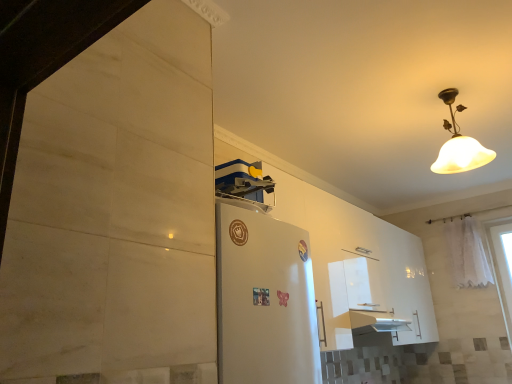
Question: Does white matte lampshade at upper right turn towards white sheer curtain at right?

Choices:
 (A) no
 (B) yes

Answer: (A)

Question: Is white matte lampshade at upper right positioned behind white sheer curtain at right?

Choices:
 (A) yes
 (B) no

Answer: (B)

Question: Considering the relative sizes of white matte lampshade at upper right and white sheer curtain at right in the image provided, is white matte lampshade at upper right smaller than white sheer curtain at right?

Choices:
 (A) yes
 (B) no

Answer: (B)

Question: Is white matte lampshade at upper right to the left of white sheer curtain at right from the viewer's perspective?

Choices:
 (A) yes
 (B) no

Answer: (A)

Question: From the image's perspective, is white matte lampshade at upper right above white sheer curtain at right?

Choices:
 (A) yes
 (B) no

Answer: (A)

Question: Can you confirm if white matte lampshade at upper right is bigger than white sheer curtain at right?

Choices:
 (A) no
 (B) yes

Answer: (B)

Question: Is white sheer curtain at right with white matte lampshade at upper right?

Choices:
 (A) no
 (B) yes

Answer: (A)

Question: From a real-world perspective, is white sheer curtain at right on white matte lampshade at upper right?

Choices:
 (A) no
 (B) yes

Answer: (A)

Question: Is white sheer curtain at right taller than white matte lampshade at upper right?

Choices:
 (A) no
 (B) yes

Answer: (B)

Question: Considering the relative positions of white sheer curtain at right and white matte lampshade at upper right in the image provided, is white sheer curtain at right to the right of white matte lampshade at upper right from the viewer's perspective?

Choices:
 (A) yes
 (B) no

Answer: (A)

Question: Does white sheer curtain at right appear on the left side of white matte lampshade at upper right?

Choices:
 (A) yes
 (B) no

Answer: (B)

Question: Is the position of white sheer curtain at right more distant than that of white matte lampshade at upper right?

Choices:
 (A) no
 (B) yes

Answer: (B)

Question: Does point (453, 155) appear closer or farther from the camera than point (474, 233)?

Choices:
 (A) farther
 (B) closer

Answer: (B)